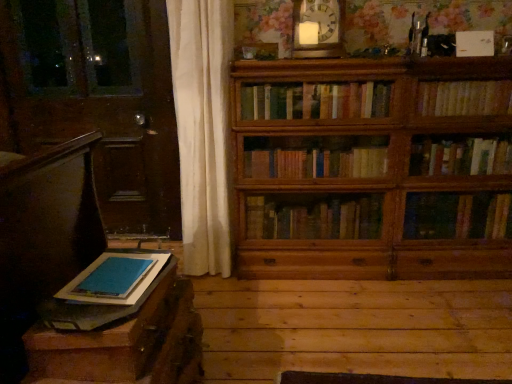
Image resolution: width=512 pixels, height=384 pixels. What are the coordinates of `unoccupied area in front of wooden bookcase at right` in the screenshot? It's located at (392, 322).